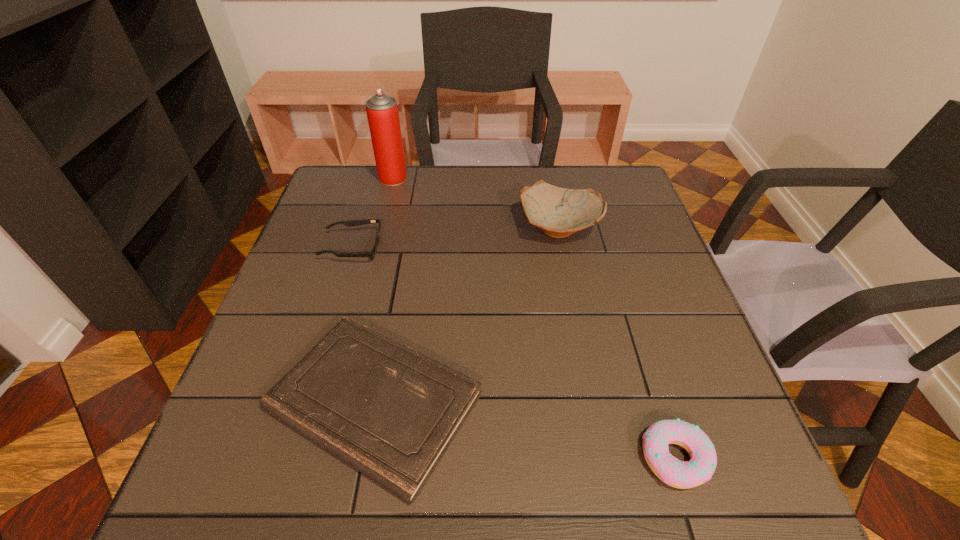
This screenshot has height=540, width=960. Find the location of `vacant region located on the back of the shortest object`. vacant region located on the back of the shortest object is located at coordinates (403, 251).

Image resolution: width=960 pixels, height=540 pixels. Find the location of `aerosol can that is at the far edge`. aerosol can that is at the far edge is located at coordinates pyautogui.click(x=382, y=112).

The height and width of the screenshot is (540, 960). I want to click on pottery that is at the far edge, so click(559, 212).

Find the location of a particular element. The width and height of the screenshot is (960, 540). doughnut that is at the near edge is located at coordinates (699, 469).

Locate an element on the screen. The height and width of the screenshot is (540, 960). paperback book at the near edge is located at coordinates (389, 411).

Locate an element on the screen. aerosol can present at the left edge is located at coordinates (382, 112).

Identify the location of sunglasses situated at the left edge. Image resolution: width=960 pixels, height=540 pixels. (352, 223).

The image size is (960, 540). Find the location of `paperback book that is at the left edge`. paperback book that is at the left edge is located at coordinates (389, 411).

The image size is (960, 540). I want to click on pottery that is at the right edge, so click(559, 212).

Locate an element on the screen. The height and width of the screenshot is (540, 960). doughnut at the right edge is located at coordinates (699, 469).